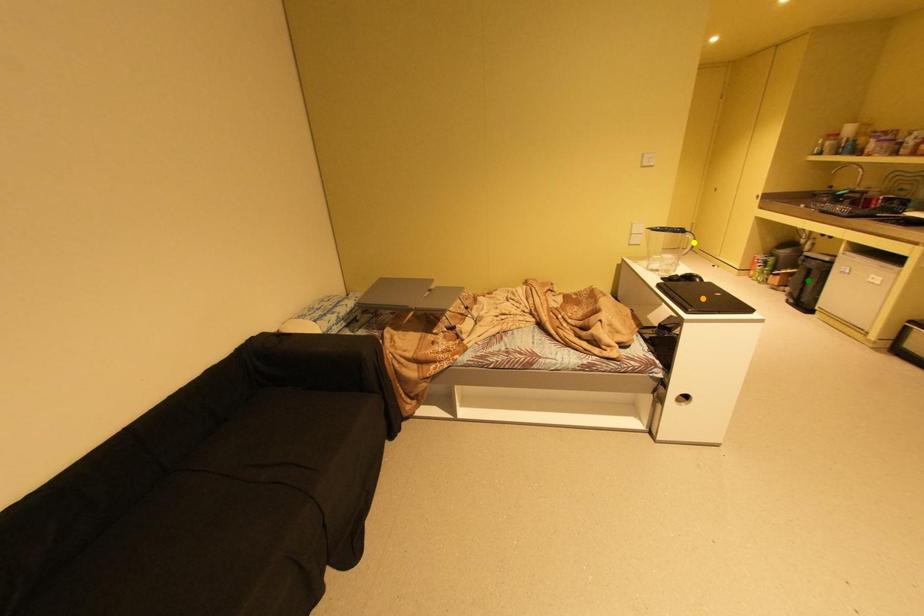
Order these from nearest to farthest:
1. green point
2. yellow point
3. orange point

orange point
yellow point
green point